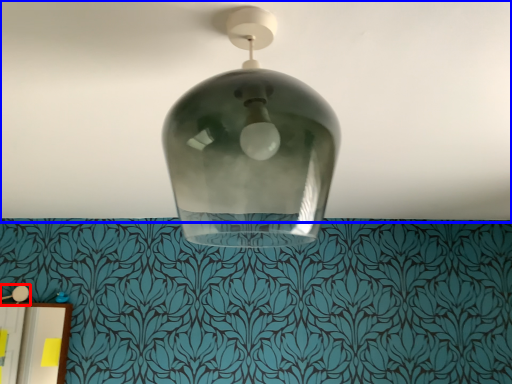
Question: Which object appears closest to the camera in this image, lamp (highlighted by a red box) or atmosphere (highlighted by a blue box)?

Choices:
 (A) lamp
 (B) atmosphere

Answer: (B)